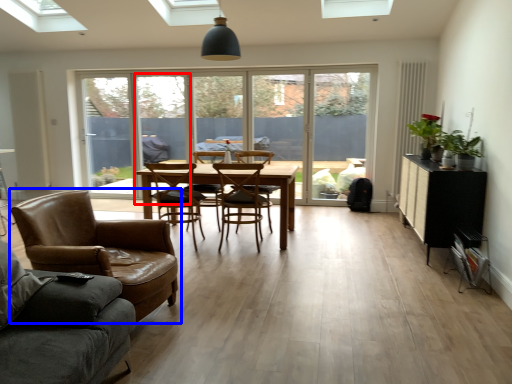
Question: Which point is further to the camera, screen door (highlighted by a red box) or chair (highlighted by a blue box)?

Choices:
 (A) screen door
 (B) chair

Answer: (A)